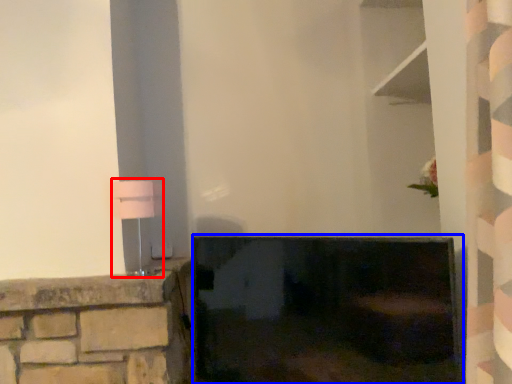
Question: Which point is further to the camera, table lamp (highlighted by a red box) or fireplace (highlighted by a blue box)?

Choices:
 (A) table lamp
 (B) fireplace

Answer: (A)